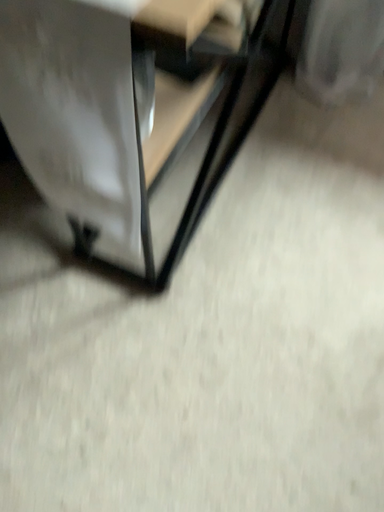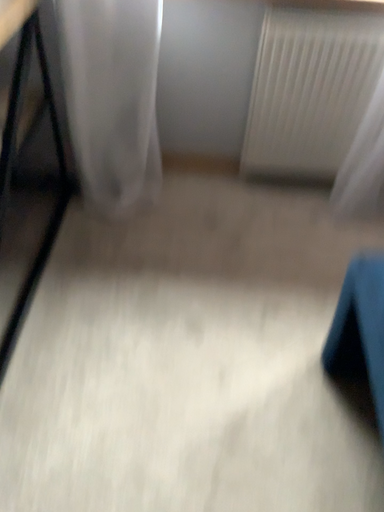
Question: Which way did the camera rotate in the video?

Choices:
 (A) rotated downward
 (B) rotated upward

Answer: (B)